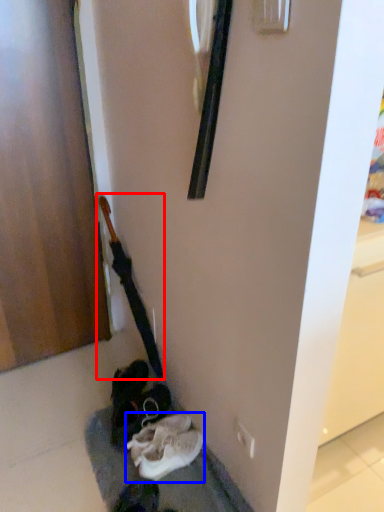
Question: Which object is further to the camera taking this photo, guitar (highlighted by a red box) or footwear (highlighted by a blue box)?

Choices:
 (A) guitar
 (B) footwear

Answer: (A)